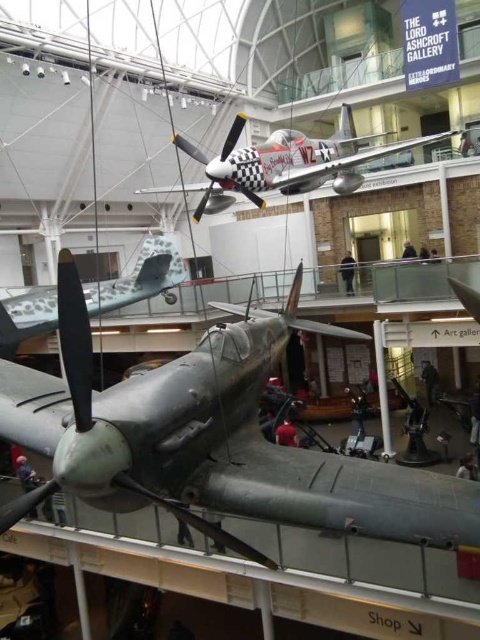
Is green matte airplane at center taller than camouflage paint airplane at center?

Indeed, green matte airplane at center has a greater height compared to camouflage paint airplane at center.

Which is behind, point (455, 515) or point (141, 285)?

Point (141, 285)

Image resolution: width=480 pixels, height=640 pixels. I want to click on green matte airplane at center, so (211, 440).

The height and width of the screenshot is (640, 480). I want to click on polished silver airplane at upper center, so click(x=285, y=163).

Is polished silver airplane at upper center behind camouflage paint airplane at center?

No, polished silver airplane at upper center is closer to the viewer.

Is point (324, 144) less distant than point (141, 276)?

Yes, it is.

Locate an element on the screen. polished silver airplane at upper center is located at coordinates (285, 163).

Can you confirm if green matte airplane at center is bigger than polished silver airplane at upper center?

No.

Does green matte airplane at center have a lesser height compared to polished silver airplane at upper center?

Correct, green matte airplane at center is not as tall as polished silver airplane at upper center.

Which is behind, point (154, 502) or point (322, 172)?

The point (322, 172) is behind.

Find the location of a particular element. The image size is (480, 640). green matte airplane at center is located at coordinates (211, 440).